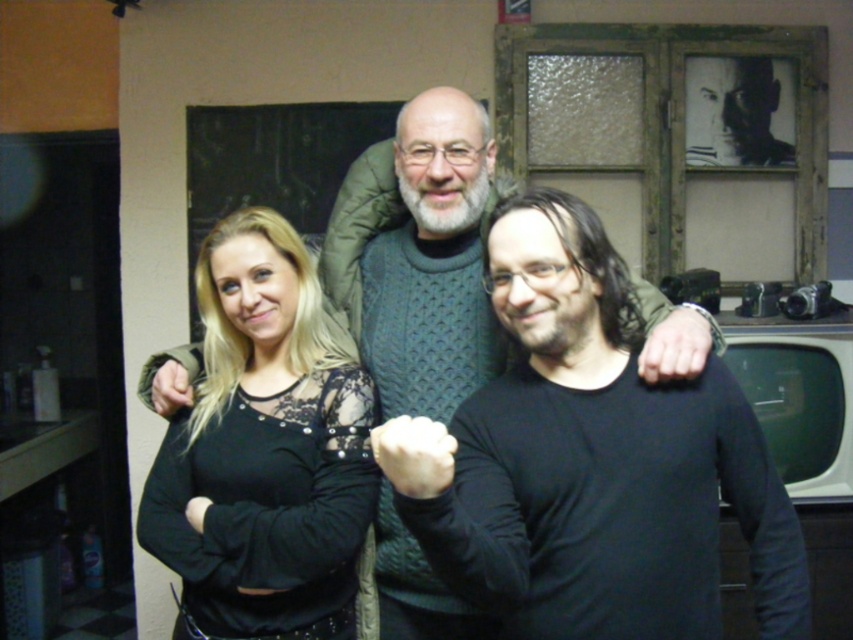
Is point (300, 397) less distant than point (397, 580)?

That is True.

Which of these two, black lace top at center or knitted sweater at center, stands shorter?

Standing shorter between the two is black lace top at center.

The width and height of the screenshot is (853, 640). I want to click on black lace top at center, so click(x=267, y=449).

Which of these two, black matte shirt at center or knitted sweater at center, stands taller?

With more height is knitted sweater at center.

Who is more forward, (628, 451) or (419, 627)?

Point (628, 451)

This screenshot has width=853, height=640. In order to click on black matte shirt at center in this screenshot , I will do `click(590, 461)`.

Does black matte shirt at center have a lesser height compared to black lace top at center?

Correct, black matte shirt at center is not as tall as black lace top at center.

The width and height of the screenshot is (853, 640). I want to click on black matte shirt at center, so click(x=590, y=461).

Locate an element on the screen. The width and height of the screenshot is (853, 640). black matte shirt at center is located at coordinates (590, 461).